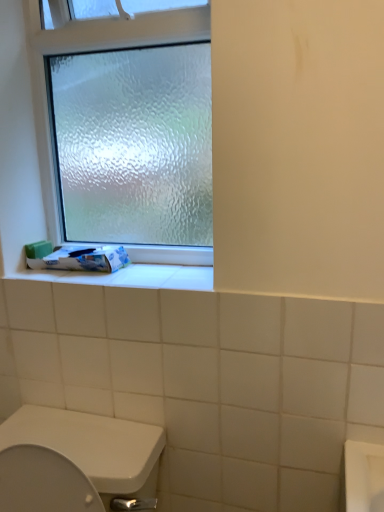
Question: Considering the relative sizes of frosted glass window at upper left and white glossy toilet paper at lower left in the image provided, is frosted glass window at upper left bigger than white glossy toilet paper at lower left?

Choices:
 (A) no
 (B) yes

Answer: (B)

Question: Can you confirm if frosted glass window at upper left is taller than white glossy toilet paper at lower left?

Choices:
 (A) no
 (B) yes

Answer: (B)

Question: Is frosted glass window at upper left to the left of white glossy toilet paper at lower left from the viewer's perspective?

Choices:
 (A) no
 (B) yes

Answer: (A)

Question: Can you confirm if frosted glass window at upper left is wider than white glossy toilet paper at lower left?

Choices:
 (A) yes
 (B) no

Answer: (B)

Question: Is frosted glass window at upper left positioned far away from white glossy toilet paper at lower left?

Choices:
 (A) no
 (B) yes

Answer: (A)

Question: Is frosted glass window at upper left touching white glossy toilet paper at lower left?

Choices:
 (A) yes
 (B) no

Answer: (B)

Question: Is the position of white glossy toilet paper at lower left less distant than that of frosted glass window at upper left?

Choices:
 (A) yes
 (B) no

Answer: (B)

Question: Is white glossy toilet paper at lower left turned away from frosted glass window at upper left?

Choices:
 (A) no
 (B) yes

Answer: (B)

Question: Can you confirm if white glossy toilet paper at lower left is thinner than frosted glass window at upper left?

Choices:
 (A) no
 (B) yes

Answer: (A)

Question: Does white glossy toilet paper at lower left appear on the right side of frosted glass window at upper left?

Choices:
 (A) no
 (B) yes

Answer: (A)

Question: Is the depth of white glossy toilet paper at lower left greater than that of frosted glass window at upper left?

Choices:
 (A) no
 (B) yes

Answer: (B)

Question: Does white glossy toilet paper at lower left touch frosted glass window at upper left?

Choices:
 (A) yes
 (B) no

Answer: (B)

Question: Is white glossy toilet paper at lower left taller or shorter than frosted glass window at upper left?

Choices:
 (A) short
 (B) tall

Answer: (A)